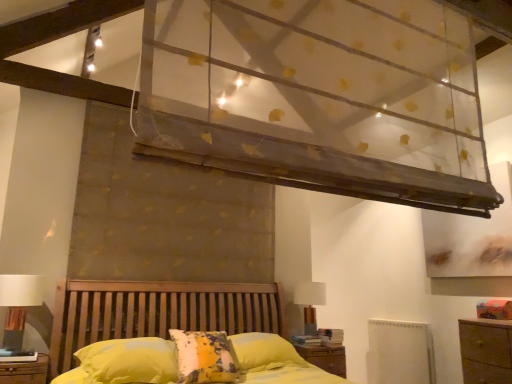
Question: Are transparent fabric canopy at upper center and white fabric lampshade at left, which is the first table lamp from left to right, located far from each other?

Choices:
 (A) no
 (B) yes

Answer: (B)

Question: Is transparent fabric canopy at upper center to the left of white fabric lampshade at left, the 1th table lamp from the front, from the viewer's perspective?

Choices:
 (A) no
 (B) yes

Answer: (A)

Question: Can you confirm if transparent fabric canopy at upper center is thinner than white fabric lampshade at left, which is the first table lamp from left to right?

Choices:
 (A) yes
 (B) no

Answer: (A)

Question: Does transparent fabric canopy at upper center have a larger size compared to white fabric lampshade at left, the 2th table lamp viewed from the back?

Choices:
 (A) yes
 (B) no

Answer: (A)

Question: Could you tell me if transparent fabric canopy at upper center is turned towards white fabric lampshade at left, the 1th table lamp from the front?

Choices:
 (A) yes
 (B) no

Answer: (B)

Question: Considering the positions of yellow fabric pillow at center and white matte radiator at lower right in the image, is yellow fabric pillow at center bigger or smaller than white matte radiator at lower right?

Choices:
 (A) small
 (B) big

Answer: (B)

Question: Considering the positions of point [x=118, y=365] and point [x=422, y=337], is point [x=118, y=365] closer or farther from the camera than point [x=422, y=337]?

Choices:
 (A) farther
 (B) closer

Answer: (B)

Question: Is yellow fabric pillow at center inside the boundaries of white matte radiator at lower right, or outside?

Choices:
 (A) outside
 (B) inside

Answer: (A)

Question: Is yellow fabric pillow at center taller or shorter than white matte radiator at lower right?

Choices:
 (A) short
 (B) tall

Answer: (A)

Question: Based on their positions, is wooden nightstand at lower center located to the left or right of white fabric lampshade at upper right, the 2th table lamp from the front?

Choices:
 (A) right
 (B) left

Answer: (A)

Question: From their relative heights in the image, would you say wooden nightstand at lower center is taller or shorter than white fabric lampshade at upper right, marked as the second table lamp in a left-to-right arrangement?

Choices:
 (A) short
 (B) tall

Answer: (A)

Question: From the image's perspective, is wooden nightstand at lower center located above or below white fabric lampshade at upper right, positioned as the first table lamp in back-to-front order?

Choices:
 (A) above
 (B) below

Answer: (B)

Question: Is wooden nightstand at lower center situated inside white fabric lampshade at upper right, positioned as the first table lamp in back-to-front order, or outside?

Choices:
 (A) outside
 (B) inside

Answer: (A)

Question: Looking at the image, does yellow fabric pillow at center seem bigger or smaller compared to white fabric lampshade at upper right, marked as the 1th table lamp in a right-to-left arrangement?

Choices:
 (A) big
 (B) small

Answer: (A)

Question: From the image's perspective, is yellow fabric pillow at center above or below white fabric lampshade at upper right, the 2th table lamp from the front?

Choices:
 (A) above
 (B) below

Answer: (A)